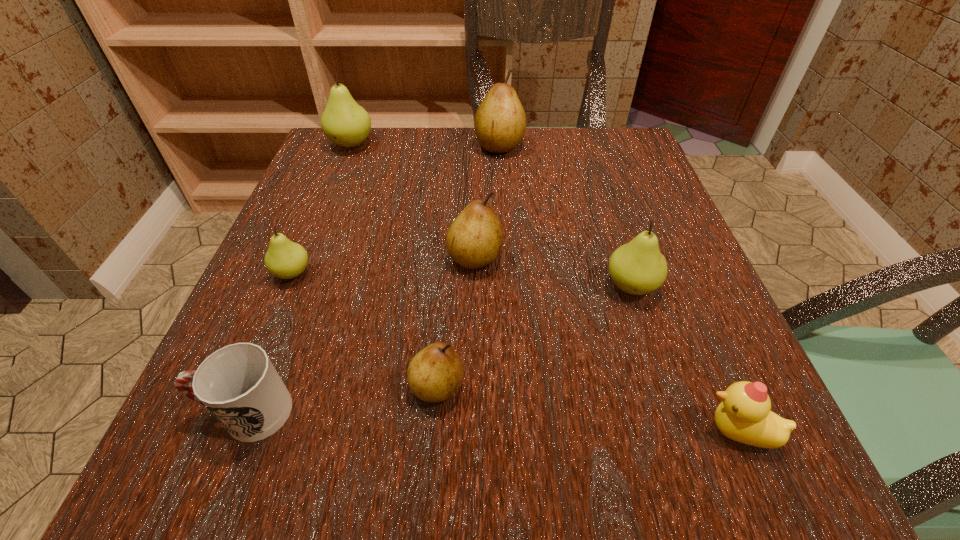
Locate which object is the fourth closest to the rightmost green pear. Please provide its 2D coordinates. Your answer should be formatted as a tuple, i.e. [(x, y)], where the tuple contains the x and y coordinates of a point satisfying the conditions above.

[(500, 121)]

Identify which object is the fifth nearest to the duckling. Please provide its 2D coordinates. Your answer should be formatted as a tuple, i.e. [(x, y)], where the tuple contains the x and y coordinates of a point satisfying the conditions above.

[(285, 259)]

You are a GUI agent. You are given a task and a screenshot of the screen. Output one action in this format:
    pyautogui.click(x=<x>, y=<y>)
    Task: Click on the pear that is the fifth closest to the second farthest brown pear
    
    Given the screenshot: What is the action you would take?
    pyautogui.click(x=345, y=123)

Identify which pear is the closest to the smallest green pear. Please provide its 2D coordinates. Your answer should be formatted as a tuple, i.e. [(x, y)], where the tuple contains the x and y coordinates of a point satisfying the conditions above.

[(475, 238)]

Identify which brown pear is the second closest to the smallest green pear. Please provide its 2D coordinates. Your answer should be formatted as a tuple, i.e. [(x, y)], where the tuple contains the x and y coordinates of a point satisfying the conditions above.

[(435, 373)]

At what (x,y) coordinates should I click in order to perform the action: click on brown pear that stands as the third closest to the smallest green pear. Please return your answer as a coordinate pair (x, y). The width and height of the screenshot is (960, 540). Looking at the image, I should click on (500, 121).

The width and height of the screenshot is (960, 540). In order to click on green pear that stands as the closest to the rightmost green pear in this screenshot , I will do `click(285, 259)`.

Locate an element on the screen. This screenshot has width=960, height=540. the second closest green pear relative to the smallest green pear is located at coordinates (637, 268).